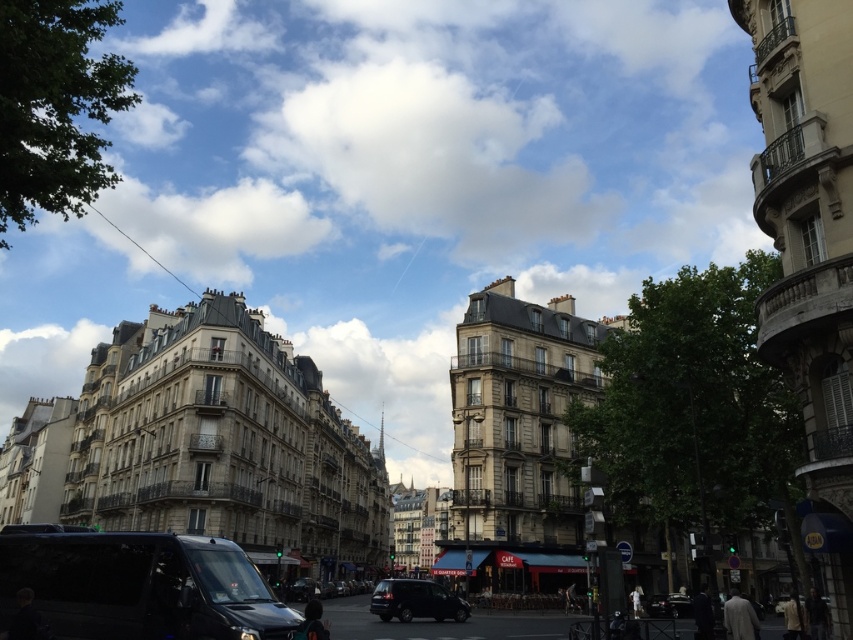
Question: Can you confirm if white fluffy cloud at upper center is positioned below shiny black van at lower left?

Choices:
 (A) yes
 (B) no

Answer: (B)

Question: Can you confirm if shiny black suv at center is positioned to the right of shiny black car at lower right?

Choices:
 (A) no
 (B) yes

Answer: (A)

Question: Is white fluffy cloud at upper center wider than shiny black van at lower left?

Choices:
 (A) no
 (B) yes

Answer: (B)

Question: Which object appears closest to the camera in this image?

Choices:
 (A) shiny black car at lower right
 (B) shiny black van at lower left
 (C) white fluffy cloud at upper center

Answer: (B)

Question: Considering the real-world distances, which object is closest to the shiny black car at lower right?

Choices:
 (A) shiny black van at lower left
 (B) white fluffy cloud at upper center
 (C) shiny black suv at center

Answer: (C)

Question: Which of the following is the closest to the observer?

Choices:
 (A) (384, 611)
 (B) (512, 172)
 (C) (183, 604)

Answer: (C)